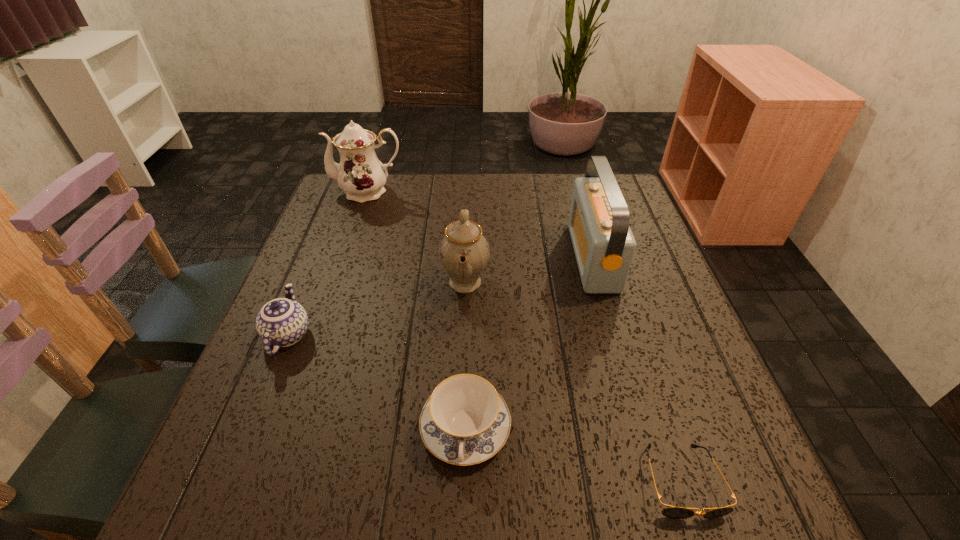
You are a GUI agent. You are given a task and a screenshot of the screen. Output one action in this format:
    pyautogui.click(x=<x>, y=<y>)
    Task: Click on the vacant area between the farthest object and the nearest chinaware
    
    Given the screenshot: What is the action you would take?
    pyautogui.click(x=417, y=310)

Identify the location of free space that is in between the farthest object and the radio receiver. The image size is (960, 540). (480, 224).

Where is `vacant space in between the fifth tallest object and the sunglasses`? This screenshot has width=960, height=540. vacant space in between the fifth tallest object and the sunglasses is located at coordinates (573, 455).

Find the location of a particular element. This screenshot has height=540, width=960. object that stands as the second closest to the second shortest chinaware is located at coordinates (464, 252).

This screenshot has height=540, width=960. Identify the location of object that stands as the fifth closest to the third shortest object. (674, 512).

Locate which chinaware ranks second in proximity to the farthest object. Please provide its 2D coordinates. Your answer should be formatted as a tuple, i.e. [(x, y)], where the tuple contains the x and y coordinates of a point satisfying the conditions above.

[(282, 322)]

Where is `chinaware that stands as the closest to the radio receiver`? The image size is (960, 540). chinaware that stands as the closest to the radio receiver is located at coordinates (464, 252).

Image resolution: width=960 pixels, height=540 pixels. Identify the location of free location that satisfies the following two spatial constraints: 1. on the front-facing side of the radio receiver; 2. with the handle on the side of the second shortest object. (641, 429).